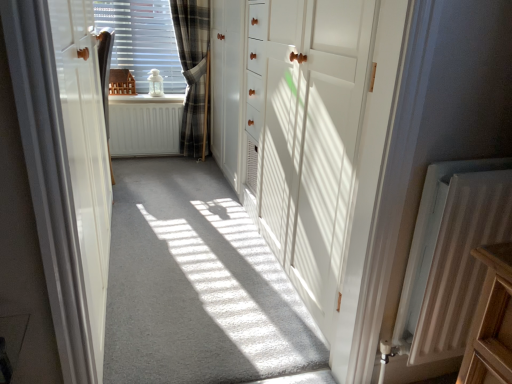
The image size is (512, 384). Find the location of `vacant space to the right of white matte radiator at center, the 1th radiator viewed from the left`. vacant space to the right of white matte radiator at center, the 1th radiator viewed from the left is located at coordinates (184, 168).